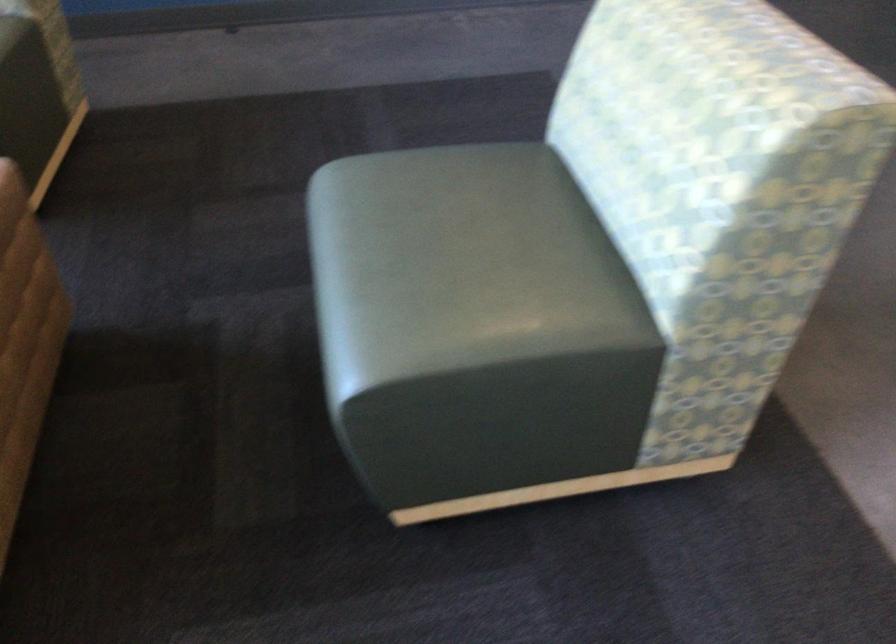
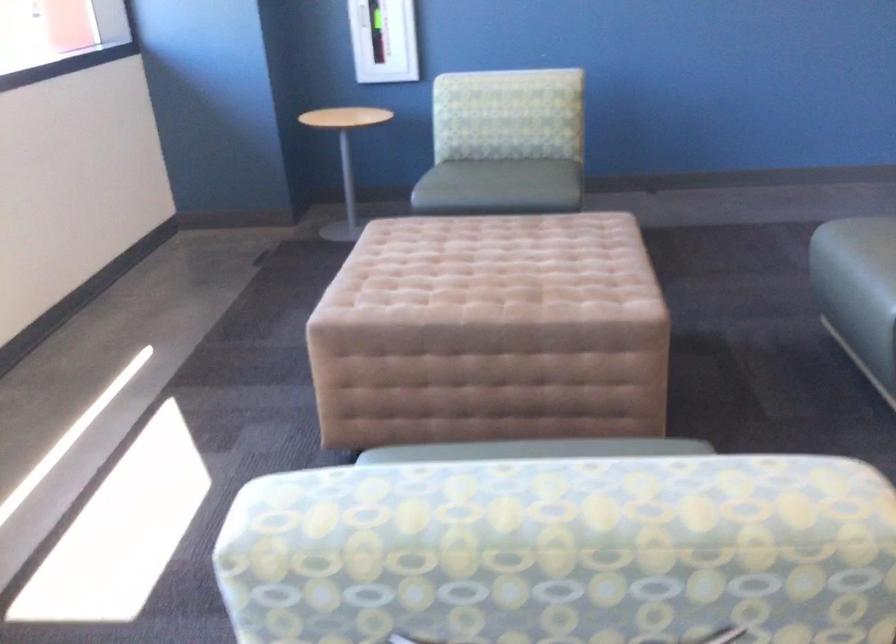
Which direction would the cameraman need to move to produce the second image?

The cameraman walked toward left, backward.